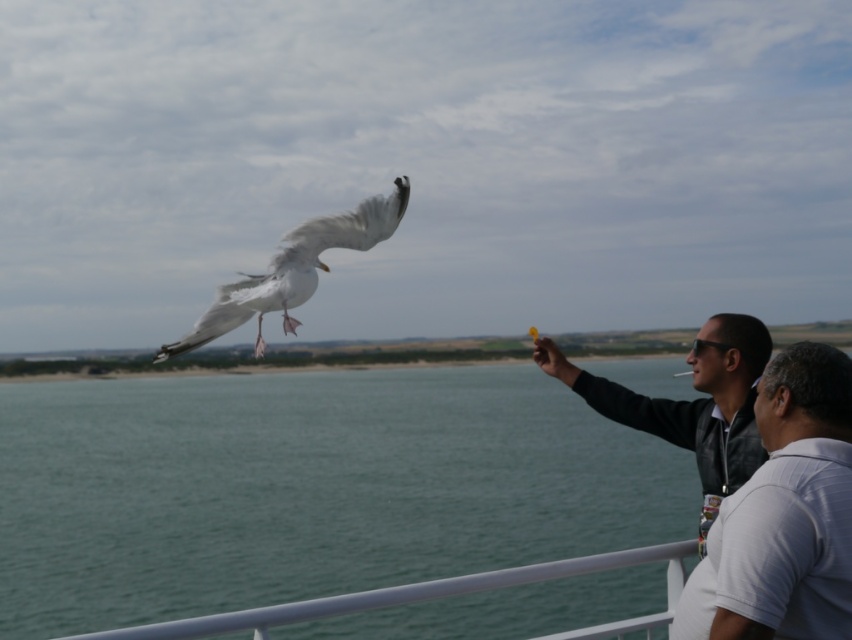
The height and width of the screenshot is (640, 852). In order to click on green water at lower left in this screenshot , I will do `click(306, 488)`.

The image size is (852, 640). In order to click on black leather jacket at right in this screenshot , I will do `click(691, 403)`.

Who is higher up, black leather jacket at right or white feathered bird at upper left?

white feathered bird at upper left

The image size is (852, 640). Describe the element at coordinates (691, 403) in the screenshot. I see `black leather jacket at right` at that location.

Identify the location of black leather jacket at right. This screenshot has height=640, width=852. (691, 403).

Who is taller, green water at lower left or white striped polo shirt at right?

green water at lower left

Does green water at lower left have a greater width compared to white striped polo shirt at right?

Indeed, green water at lower left has a greater width compared to white striped polo shirt at right.

The image size is (852, 640). What are the coordinates of `green water at lower left` in the screenshot? It's located at (306, 488).